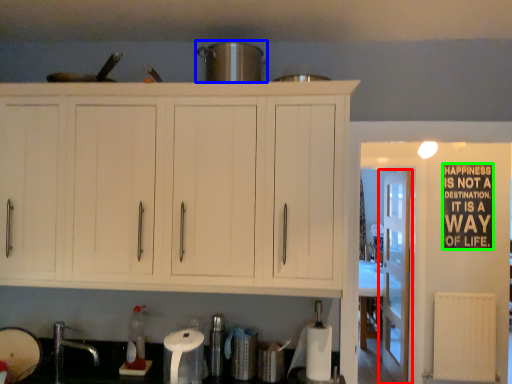
Question: Which is nearer to the door (highlighted by a red box)? appliance (highlighted by a blue box) or bulletin board (highlighted by a green box).

Choices:
 (A) appliance
 (B) bulletin board

Answer: (B)